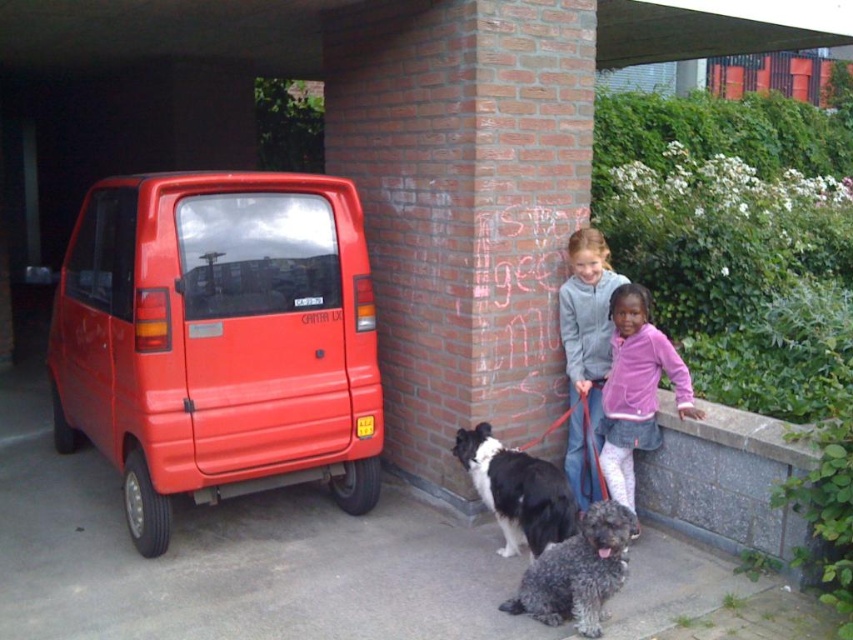
Question: Which point is farther to the camera?

Choices:
 (A) curly gray fur at lower center
 (B) matte gray hoodie at center
 (C) pink fleece jacket at center

Answer: (B)

Question: Where is pink fleece jacket at center located in relation to black and white fur dog at center in the image?

Choices:
 (A) left
 (B) right

Answer: (B)

Question: Is matte gray hoodie at center thinner than black and white fur dog at center?

Choices:
 (A) yes
 (B) no

Answer: (A)

Question: Which point appears closest to the camera in this image?

Choices:
 (A) (546, 572)
 (B) (605, 243)
 (C) (212, 244)

Answer: (A)

Question: Based on their relative distances, which object is farther from the matte gray hoodie at center?

Choices:
 (A) pink fleece jacket at center
 (B) black and white fur dog at center

Answer: (B)

Question: Can you confirm if matte red van at left is smaller than curly gray fur at lower center?

Choices:
 (A) no
 (B) yes

Answer: (A)